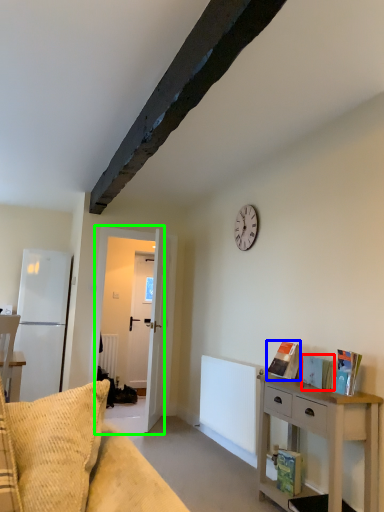
Question: Which object is the closest to the book (highlighted by a red box)? Choose among these: book (highlighted by a blue box) or door (highlighted by a green box).

Choices:
 (A) book
 (B) door

Answer: (A)